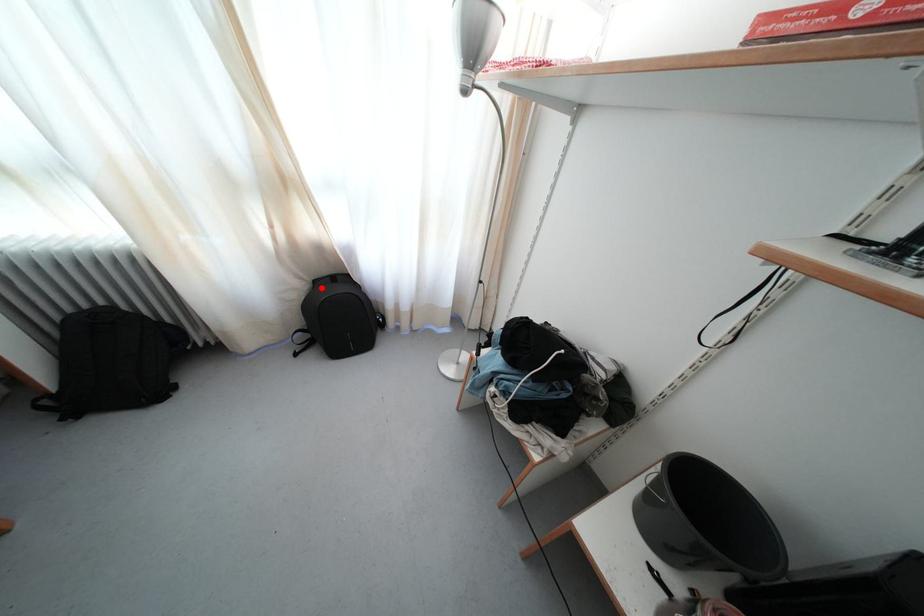
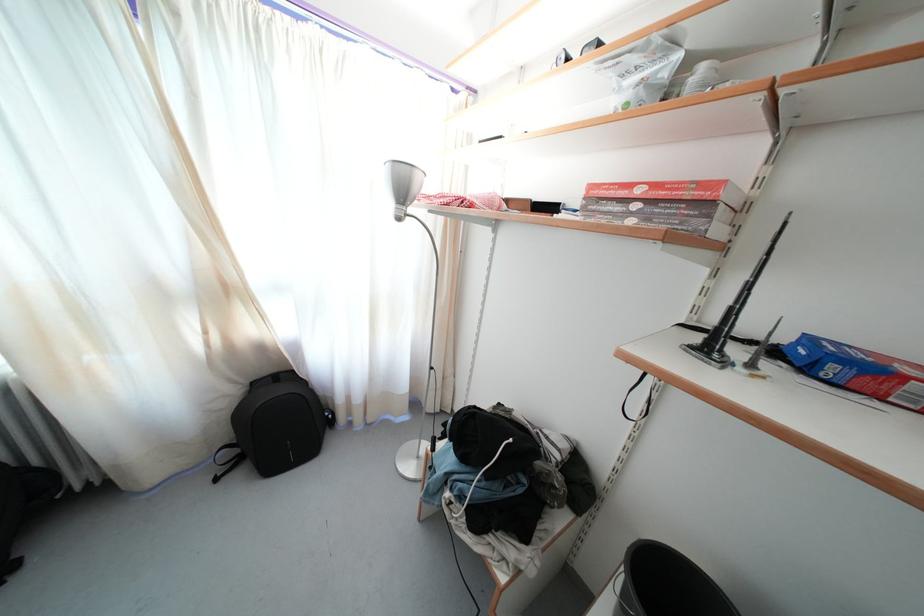
Where in the second image is the point corresponding to the highlighted location from the first image?

(259, 390)